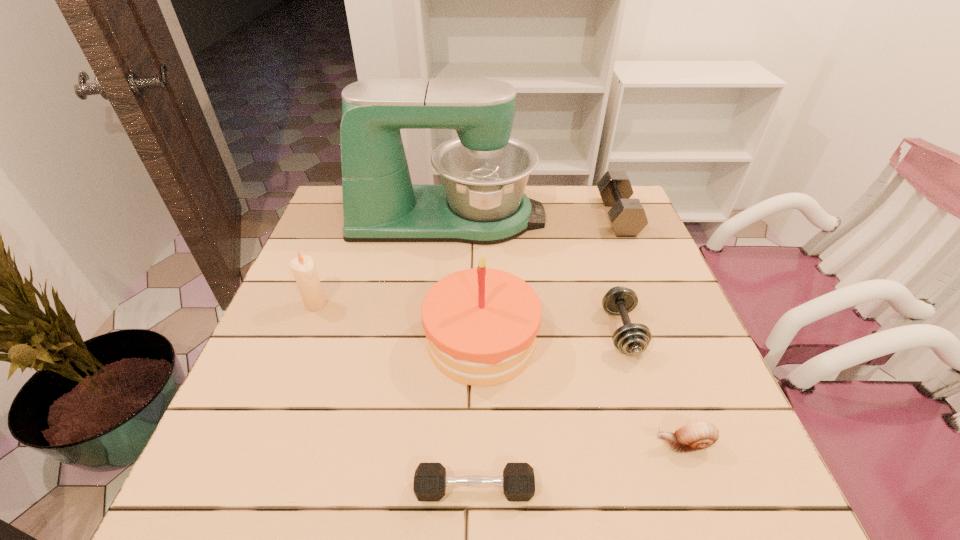
You are a GUI agent. You are given a task and a screenshot of the screen. Output one action in this format:
    pyautogui.click(x=<x>, y=<y>)
    Task: Click on the unoccupied position between the farthest dumbbell and the escargot
    This screenshot has height=540, width=960.
    Given the screenshot: What is the action you would take?
    pyautogui.click(x=650, y=330)

At what (x,y) coordinates should I click in order to perform the action: click on free space between the birthday cake and the candle. Please return your answer as a coordinate pair (x, y). Looking at the image, I should click on (398, 323).

The image size is (960, 540). In order to click on unoccupied area between the farthest dumbbell and the nearest dumbbell in this screenshot , I will do `click(546, 353)`.

You are a GUI agent. You are given a task and a screenshot of the screen. Output one action in this format:
    pyautogui.click(x=<x>, y=<y>)
    Task: Click on the object that is the fifth closest to the second shortest object
    
    Given the screenshot: What is the action you would take?
    pyautogui.click(x=627, y=216)

Locate which object is the fifth closest to the farthest dumbbell. Please provide its 2D coordinates. Your answer should be formatted as a tuple, i.e. [(x, y)], where the tuple contains the x and y coordinates of a point satisfying the conditions above.

[(430, 480)]

This screenshot has width=960, height=540. Identify the location of the second closest dumbbell to the escargot. (430, 480).

Locate which dumbbell is the closest to the candle. Please provide its 2D coordinates. Your answer should be formatted as a tuple, i.e. [(x, y)], where the tuple contains the x and y coordinates of a point satisfying the conditions above.

[(430, 480)]

What are the coordinates of `free space that satisfies the following two spatial constraints: 1. on the front-facing side of the second shortest object; 2. on the front side of the nearest object` in the screenshot? It's located at (699, 489).

Where is `free point that satisfies the following two spatial constraints: 1. on the front-facing side of the mixer; 2. on the left side of the shortest dumbbell`? The image size is (960, 540). free point that satisfies the following two spatial constraints: 1. on the front-facing side of the mixer; 2. on the left side of the shortest dumbbell is located at coordinates (421, 489).

The width and height of the screenshot is (960, 540). Identify the location of vacant point that satisfies the following two spatial constraints: 1. on the front side of the leftmost dumbbell; 2. on the right side of the fifth shortest object. (245, 489).